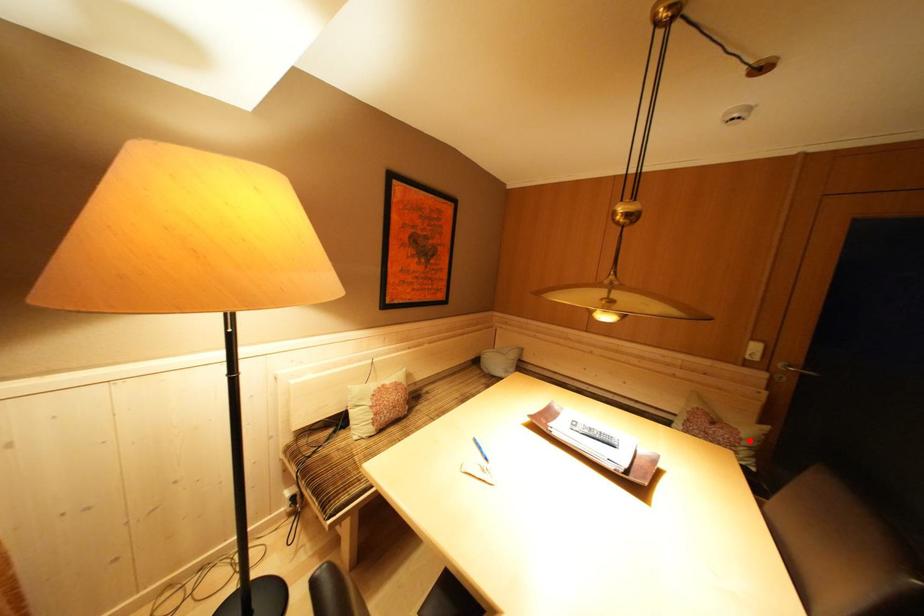
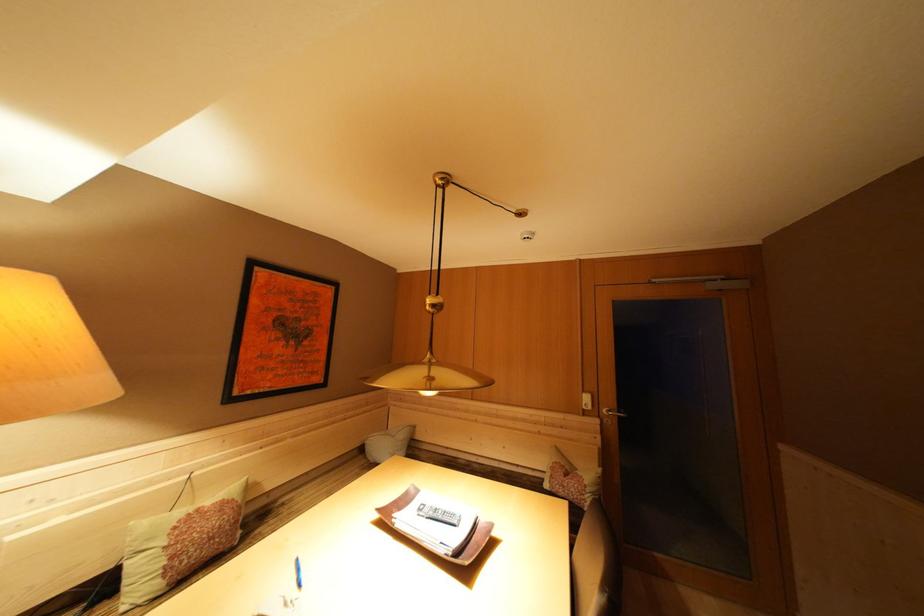
Locate, in the second image, the point that corresponds to the highlighted location in the first image.

(592, 487)